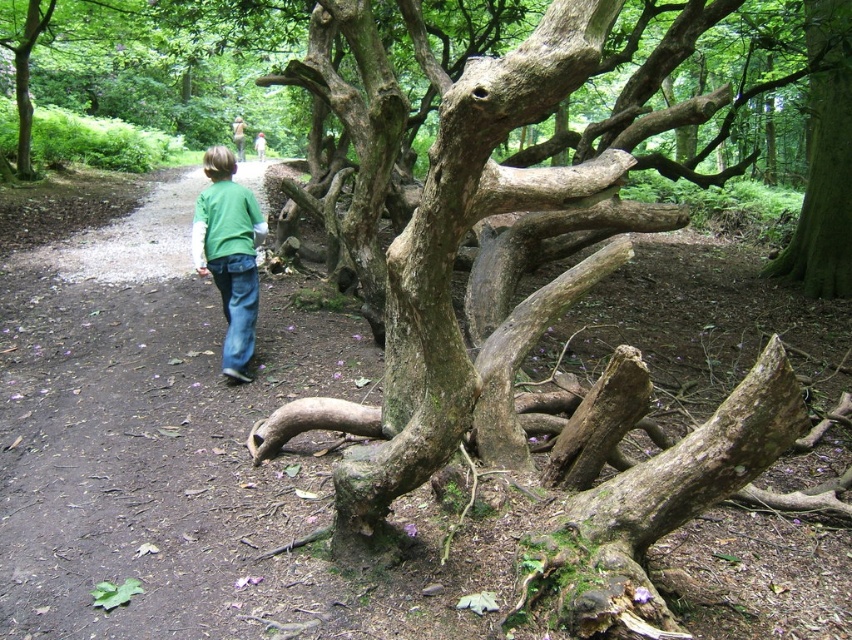
Who is lower down, green rough bark tree at upper right or blue denim jeans at center?

blue denim jeans at center

Between point (833, 28) and point (229, 301), which one is positioned behind?

The point (833, 28) is behind.

Locate an element on the screen. This screenshot has width=852, height=640. green rough bark tree at upper right is located at coordinates (824, 161).

Does green matte shirt at center appear on the right side of blue denim jeans at center?

In fact, green matte shirt at center is to the left of blue denim jeans at center.

Who is lower down, green matte shirt at center or blue denim jeans at center?

blue denim jeans at center is below.

What do you see at coordinates (229, 253) in the screenshot? This screenshot has height=640, width=852. I see `green matte shirt at center` at bounding box center [229, 253].

Identify the location of green matte shirt at center. (229, 253).

Between point (822, 193) and point (239, 339), which one is positioned in front?

Point (239, 339) is more forward.

Between point (839, 28) and point (225, 289), which one is positioned behind?

Point (839, 28)

Where is `green rough bark tree at upper right`? The image size is (852, 640). green rough bark tree at upper right is located at coordinates (824, 161).